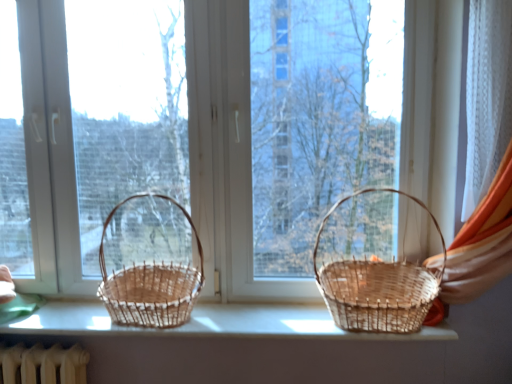
Image resolution: width=512 pixels, height=384 pixels. I want to click on free space to the left of woven brown picnic basket at left, which ranks as the 2th picnic basket in right-to-left order, so click(x=63, y=314).